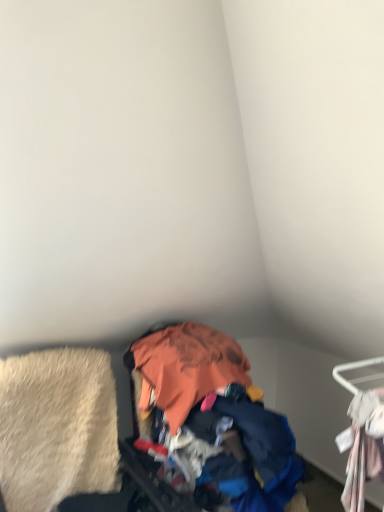
Question: Can you confirm if orange fabric pile at center is bigger than white fabric hanger at right?

Choices:
 (A) no
 (B) yes

Answer: (B)

Question: Is orange fabric pile at center with white fabric hanger at right?

Choices:
 (A) yes
 (B) no

Answer: (B)

Question: Is orange fabric pile at center far away from white fabric hanger at right?

Choices:
 (A) no
 (B) yes

Answer: (A)

Question: Does orange fabric pile at center come in front of white fabric hanger at right?

Choices:
 (A) yes
 (B) no

Answer: (B)

Question: Considering the relative sizes of orange fabric pile at center and white fabric hanger at right in the image provided, is orange fabric pile at center smaller than white fabric hanger at right?

Choices:
 (A) no
 (B) yes

Answer: (A)

Question: Which is correct: beige shag rug at lower left is inside white fabric hanger at right, or outside of it?

Choices:
 (A) outside
 (B) inside

Answer: (A)

Question: From a real-world perspective, is beige shag rug at lower left positioned above or below white fabric hanger at right?

Choices:
 (A) above
 (B) below

Answer: (B)

Question: Does point (46, 436) appear closer or farther from the camera than point (377, 401)?

Choices:
 (A) farther
 (B) closer

Answer: (A)

Question: In the image, is beige shag rug at lower left positioned in front of or behind white fabric hanger at right?

Choices:
 (A) behind
 (B) front

Answer: (A)

Question: Is orange fabric pile at center to the left or to the right of beige shag rug at lower left in the image?

Choices:
 (A) right
 (B) left

Answer: (A)

Question: In terms of width, does orange fabric pile at center look wider or thinner when compared to beige shag rug at lower left?

Choices:
 (A) wide
 (B) thin

Answer: (A)

Question: From a real-world perspective, is orange fabric pile at center physically located above or below beige shag rug at lower left?

Choices:
 (A) below
 (B) above

Answer: (A)

Question: In terms of height, does orange fabric pile at center look taller or shorter compared to beige shag rug at lower left?

Choices:
 (A) short
 (B) tall

Answer: (B)

Question: From a real-world perspective, relative to orange fabric pile at center, is beige shag rug at lower left vertically above or below?

Choices:
 (A) above
 (B) below

Answer: (A)

Question: Considering the positions of beige shag rug at lower left and orange fabric pile at center in the image, is beige shag rug at lower left taller or shorter than orange fabric pile at center?

Choices:
 (A) tall
 (B) short

Answer: (B)